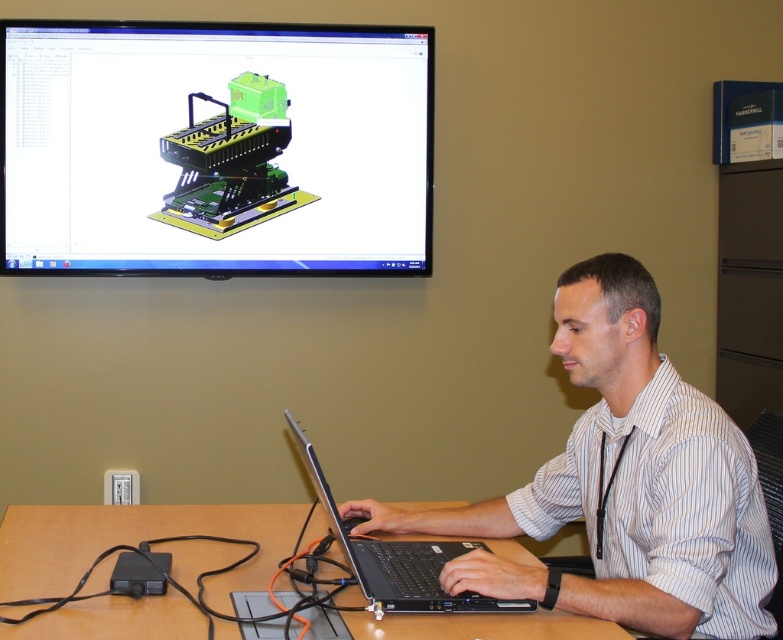
From the picture: You are a photographer standing in front of the scene. You need to capture a photo that includes both the white striped shirt at center and the brown wooden table at center. Which object should you focus on to ensure both are in frame?

You should focus on the brown wooden table at center because the white striped shirt at center is positioned over it, meaning both will be visible in the same frame when the table is centered in the shot.

What are the coordinates of the white striped shirt at center?

The coordinates of the white striped shirt at center are at point (623, 484).

You are a photographer standing in front of the scene. You want to take a photo that clearly shows both the white striped shirt at center and the brown wooden table at center. Which object should you focus on to ensure both are in frame and properly exposed?

The white striped shirt at center has a greater height compared to the brown wooden table at center, so focusing on the shirt will help ensure both are in frame and properly exposed.